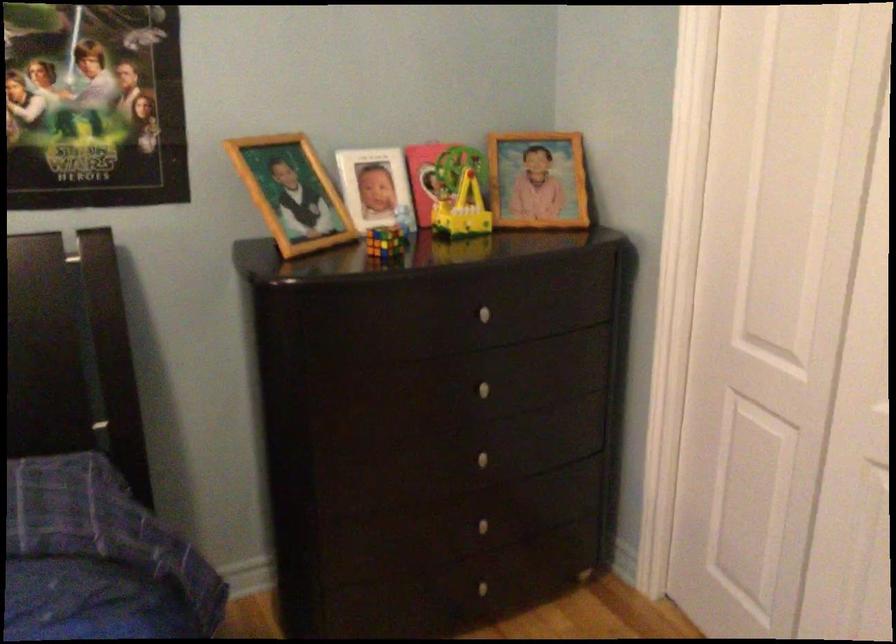
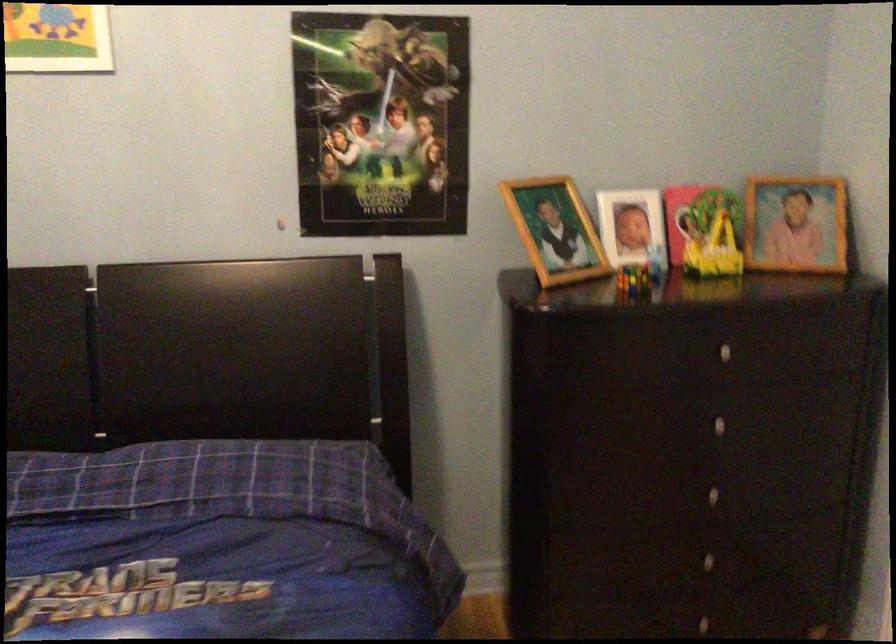
Find the pixel in the second image that matches point (296, 194) in the first image.

(555, 230)